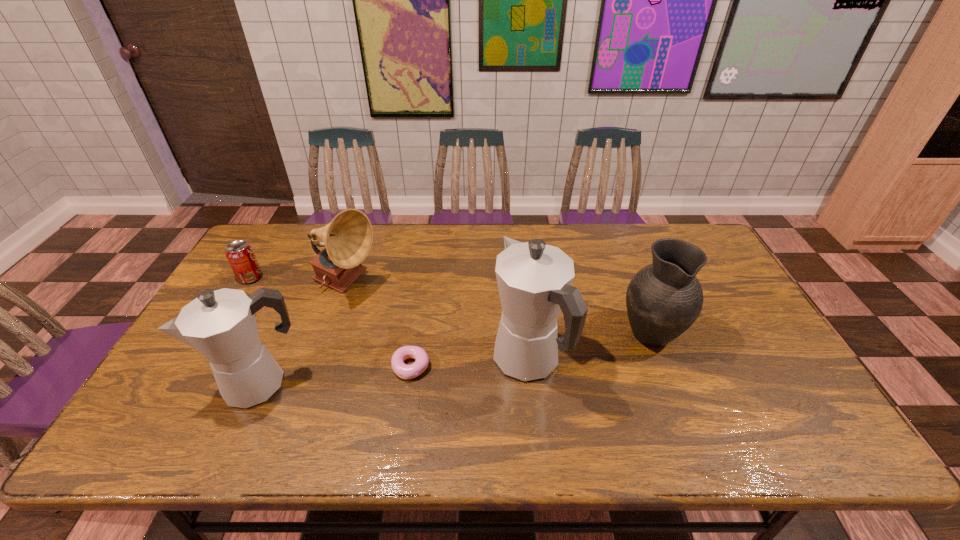
Image resolution: width=960 pixels, height=540 pixels. I want to click on the shorter coffeepot, so click(x=221, y=325).

Locate an element on the screen. Image resolution: width=960 pixels, height=540 pixels. the second object from right to left is located at coordinates (534, 279).

Where is `the right coffeepot`? The width and height of the screenshot is (960, 540). the right coffeepot is located at coordinates (534, 279).

Find the location of a particular element. soda can is located at coordinates (240, 255).

In order to click on the leftmost object in this screenshot , I will do `click(240, 255)`.

I want to click on pitcher, so click(x=663, y=299).

Find the location of a particular element. This screenshot has width=960, height=540. phonograph record is located at coordinates (348, 238).

You are a GUI agent. You are given a task and a screenshot of the screen. Output one action in this format:
    pyautogui.click(x=<x>, y=<y>)
    Task: Click on the shortest object
    
    Given the screenshot: What is the action you would take?
    pyautogui.click(x=402, y=370)

Find the location of a particular element. the third object from right to left is located at coordinates (402, 370).

The width and height of the screenshot is (960, 540). I want to click on vacant area situated 0.140m on the right of the shorter coffeepot, so click(359, 384).